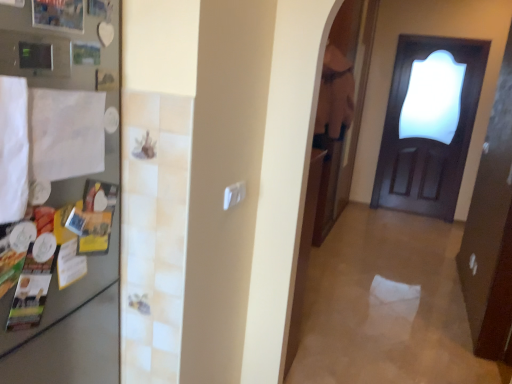
Where is `dark wood door at right`? The width and height of the screenshot is (512, 384). dark wood door at right is located at coordinates (428, 137).

What do you see at coordinates (428, 137) in the screenshot? The image size is (512, 384). I see `dark wood door at right` at bounding box center [428, 137].

Measure the distance between point (60,292) and camera.

Point (60,292) and camera are 3.57 feet apart.

What do you see at coordinates (69, 330) in the screenshot? I see `satin silver fridge at left` at bounding box center [69, 330].

At what (x,y) coordinates should I click in order to perform the action: click on satin silver fridge at left. Please return your answer as a coordinate pair (x, y). This screenshot has height=384, width=512. Looking at the image, I should click on (69, 330).

I want to click on dark wood door at right, so click(428, 137).

Considering the positions of objects satin silver fridge at left and dark wood door at right in the image provided, who is more to the left, satin silver fridge at left or dark wood door at right?

Positioned to the left is satin silver fridge at left.

Relative to dark wood door at right, is satin silver fridge at left in front or behind?

Clearly, satin silver fridge at left is in front of dark wood door at right.

Which is in front, point (17, 343) or point (430, 153)?

Point (17, 343)

From the image's perspective, is satin silver fridge at left above or below dark wood door at right?

satin silver fridge at left is situated lower than dark wood door at right in the image.

From a real-world perspective, which object rests below the other?

dark wood door at right is physically lower.

Which of these two, satin silver fridge at left or dark wood door at right, is wider?

dark wood door at right.

Between satin silver fridge at left and dark wood door at right, which one has less height?

Standing shorter between the two is satin silver fridge at left.

Who is smaller, satin silver fridge at left or dark wood door at right?

satin silver fridge at left is smaller.

Is satin silver fridge at left not within dark wood door at right?

That's correct, satin silver fridge at left is outside of dark wood door at right.

Is satin silver fridge at left not close to dark wood door at right?

Yes, satin silver fridge at left and dark wood door at right are located far from each other.

Is satin silver fridge at left oriented away from dark wood door at right?

No, satin silver fridge at left is not facing away from dark wood door at right.

Image resolution: width=512 pixels, height=384 pixels. Find the location of `fridge on the left of dark wood door at right`. fridge on the left of dark wood door at right is located at coordinates tap(69, 330).

Is dark wood door at right to the right of satin silver fridge at left from the viewer's perspective?

Yes, dark wood door at right is to the right of satin silver fridge at left.

Which object is closer to the camera, dark wood door at right or satin silver fridge at left?

satin silver fridge at left is more forward.

Is point (394, 96) in front of point (118, 55)?

No, it is not.

From the image's perspective, is dark wood door at right positioned above or below satin silver fridge at left?

Clearly, from the image's perspective, dark wood door at right is above satin silver fridge at left.

From a real-world perspective, is dark wood door at right under satin silver fridge at left?

Yes, from a real-world perspective, dark wood door at right is under satin silver fridge at left.

Does dark wood door at right have a lesser width compared to satin silver fridge at left?

No, dark wood door at right is not thinner than satin silver fridge at left.

Considering the relative sizes of dark wood door at right and satin silver fridge at left in the image provided, is dark wood door at right shorter than satin silver fridge at left?

Incorrect, the height of dark wood door at right does not fall short of that of satin silver fridge at left.

Considering the sizes of dark wood door at right and satin silver fridge at left in the image, is dark wood door at right bigger or smaller than satin silver fridge at left?

dark wood door at right is bigger than satin silver fridge at left.

Is dark wood door at right inside or outside of satin silver fridge at left?

dark wood door at right cannot be found inside satin silver fridge at left.

Is dark wood door at right positioned far away from satin silver fridge at left?

dark wood door at right is far away from satin silver fridge at left.

Could you tell me if dark wood door at right is facing satin silver fridge at left?

Yes, dark wood door at right is facing satin silver fridge at left.

In the image, there is a satin silver fridge at left. At what (x,y) coordinates should I click in order to perform the action: click on door above it (from the image's perspective). Please return your answer as a coordinate pair (x, y). The width and height of the screenshot is (512, 384). Looking at the image, I should click on 428,137.

Find the location of a particular element. This screenshot has width=512, height=384. fridge above the dark wood door at right (from a real-world perspective) is located at coordinates (69, 330).

The image size is (512, 384). Find the location of `door behind the satin silver fridge at left`. door behind the satin silver fridge at left is located at coordinates (428, 137).